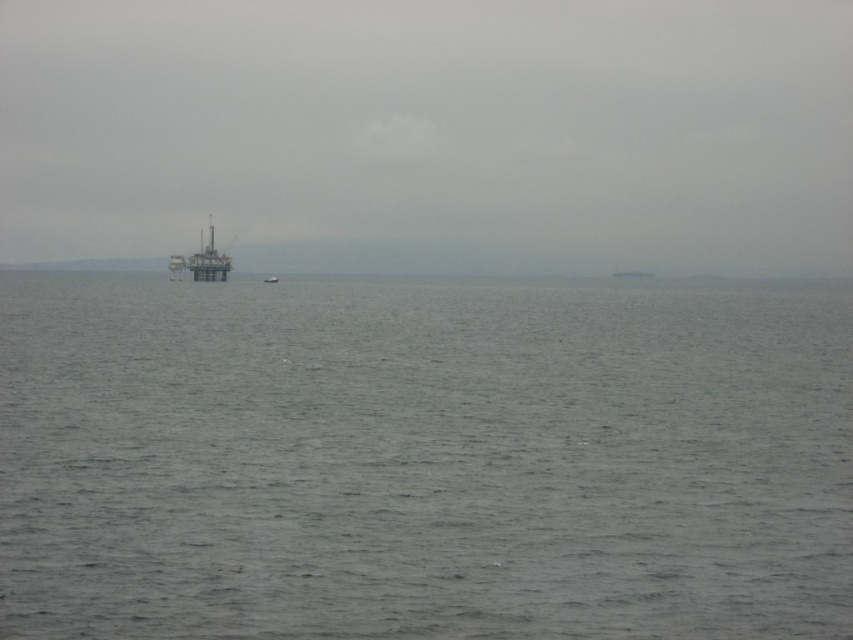
Question: Which object appears closest to the camera in this image?

Choices:
 (A) metallic gray platform at center
 (B) white plastic boat at center

Answer: (A)

Question: Estimate the real-world distances between objects in this image. Which object is farther from the metallic gray platform at center?

Choices:
 (A) white plastic boat at center
 (B) gray matte water at center

Answer: (B)

Question: Can you confirm if metallic gray platform at center is positioned above gray matte boat at center?

Choices:
 (A) no
 (B) yes

Answer: (B)

Question: Estimate the real-world distances between objects in this image. Which object is farther from the gray matte boat at center?

Choices:
 (A) white plastic boat at center
 (B) metallic gray platform at center

Answer: (B)

Question: Is gray matte boat at center to the right of white plastic boat at center from the viewer's perspective?

Choices:
 (A) no
 (B) yes

Answer: (B)

Question: Observing the image, what is the correct spatial positioning of gray matte water at center in reference to gray matte boat at center?

Choices:
 (A) above
 (B) below

Answer: (B)